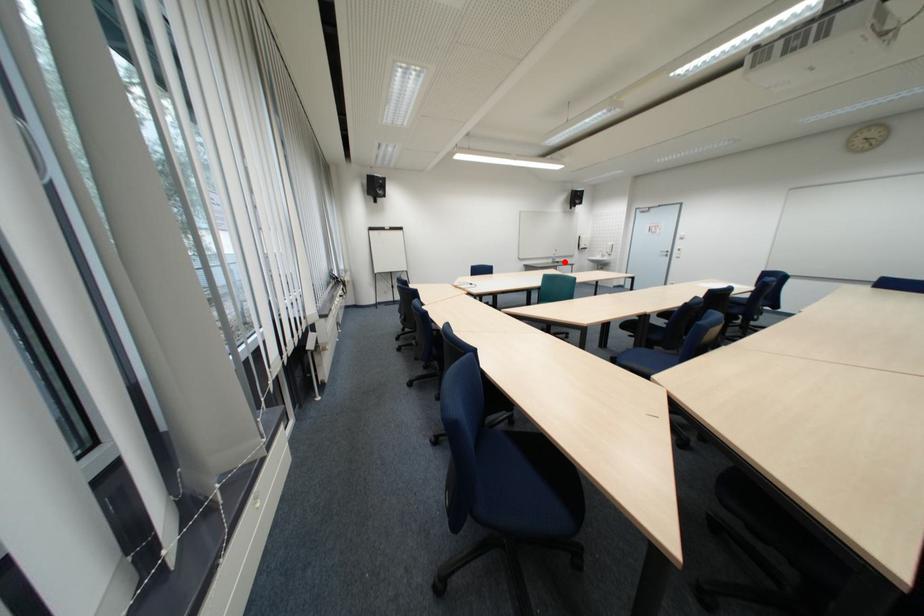
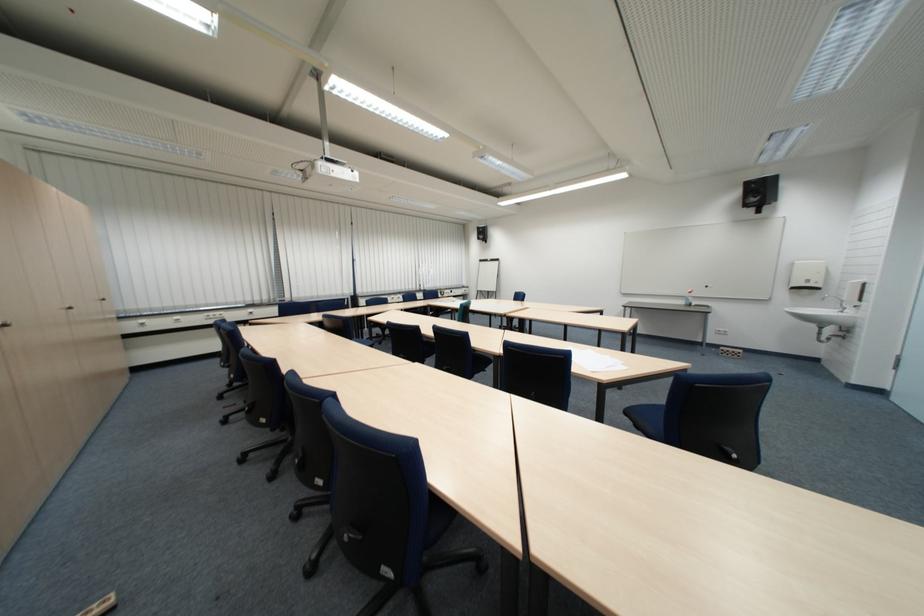
Question: I am providing you with two images of the same scene from different viewpoints. In image1, a red point is highlighted. Considering the same 3D point in image2, which of the following is correct?

Choices:
 (A) It is closer
 (B) It is farther

Answer: (A)